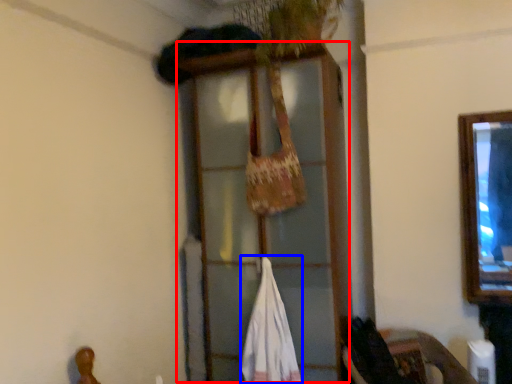
Question: Among these objects, which one is farthest to the camera, window frame (highlighted by a red box) or wide (highlighted by a blue box)?

Choices:
 (A) window frame
 (B) wide

Answer: (B)